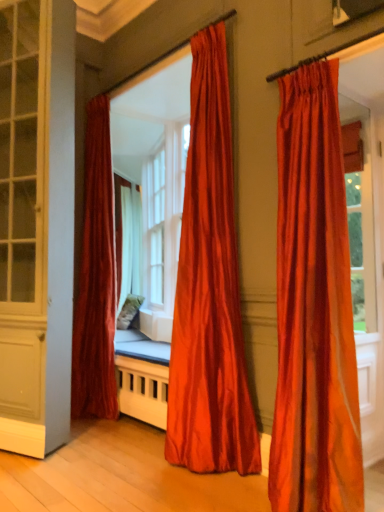
Image resolution: width=384 pixels, height=512 pixels. What are the coordinates of `vacant space that is in between satin orange curtain at center, which ranks as the 2th curtain in right-to-left order, and matte white screen door at left` in the screenshot? It's located at (117, 460).